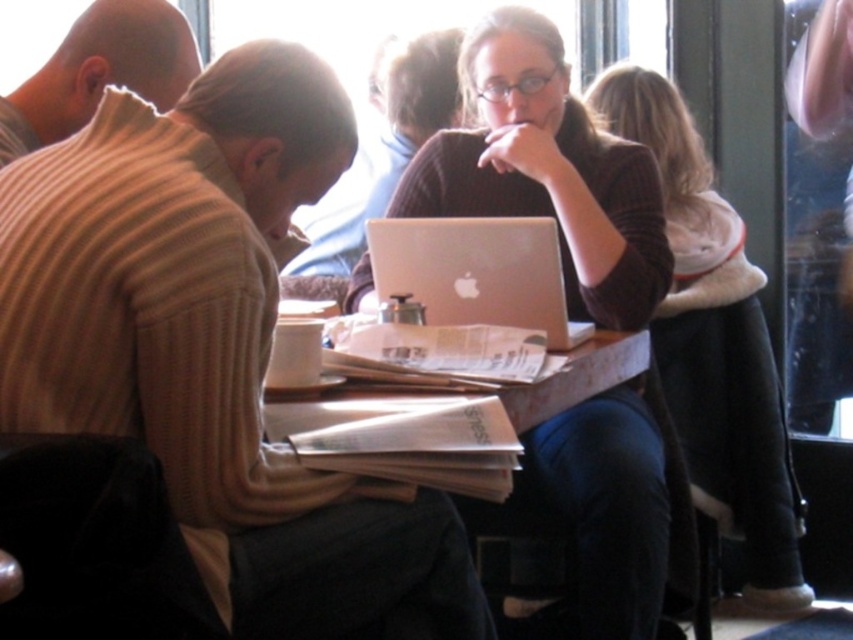
You are a photographer taking a picture of the scene. The beige ribbed sweater at center and the white paper at center are both in the frame. Which object is covering the other?

The beige ribbed sweater at center is positioned over the white paper at center, so it is covering the white paper at center.

You are a customer at this cafe and you want to place your coffee mug on the table. The white paper at center and the silver metallic laptop at center are already there. Where should you place the mug so it doesn not block either object?

Place the mug to the side of the table, as the white paper at center is below the silver metallic laptop at center, so they are stacked or positioned in a way that leaves space on the sides.

You are standing at the point labeled as point (169, 480) in the image. You want to move to the nearest exit, which is located behind you. Can you turn around completely to face the exit without moving your feet?

The point (169, 480) and viewer are 4.14 feet apart. Since the distance is sufficient, you can turn around completely to face the exit without moving your feet.